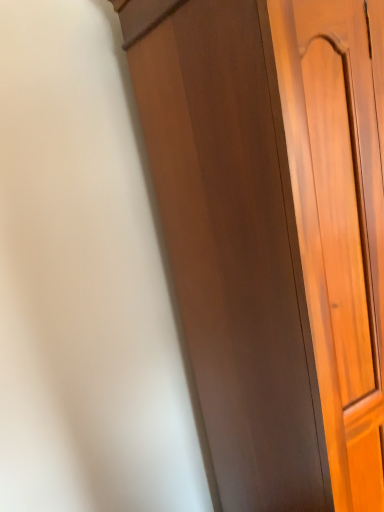
The image size is (384, 512). Find the location of `matte brown cupboard at center`. matte brown cupboard at center is located at coordinates (274, 234).

This screenshot has height=512, width=384. What do you see at coordinates (274, 234) in the screenshot?
I see `matte brown cupboard at center` at bounding box center [274, 234].

Where is `matte brown cupboard at center`? matte brown cupboard at center is located at coordinates (274, 234).